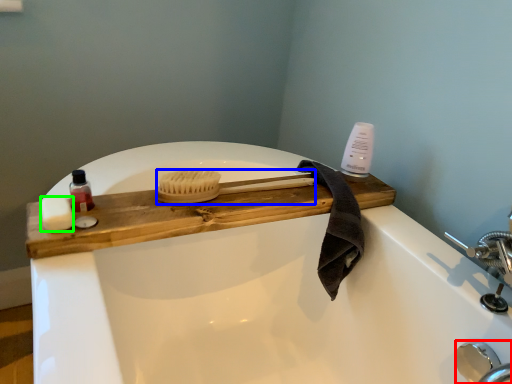
Question: Considering the real-world distances, which object is farthest from faucet (highlighted by a red box)? brush (highlighted by a blue box) or soap (highlighted by a green box)?

Choices:
 (A) brush
 (B) soap

Answer: (B)